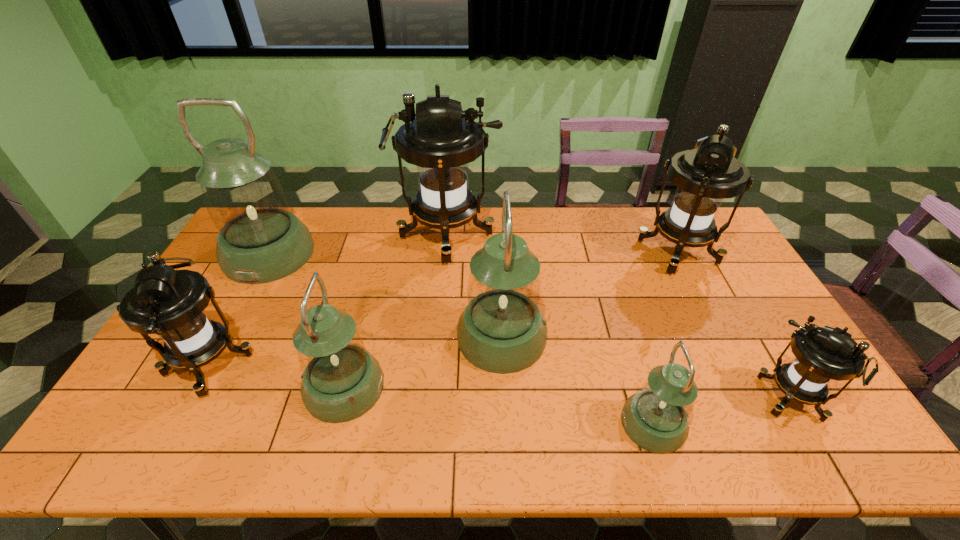
Locate an element on the screen. This screenshot has width=960, height=540. vacant region that satisfies the following two spatial constraints: 1. on the front side of the farthest greenish lantern; 2. on the left side of the sixth object from left to right is located at coordinates (177, 424).